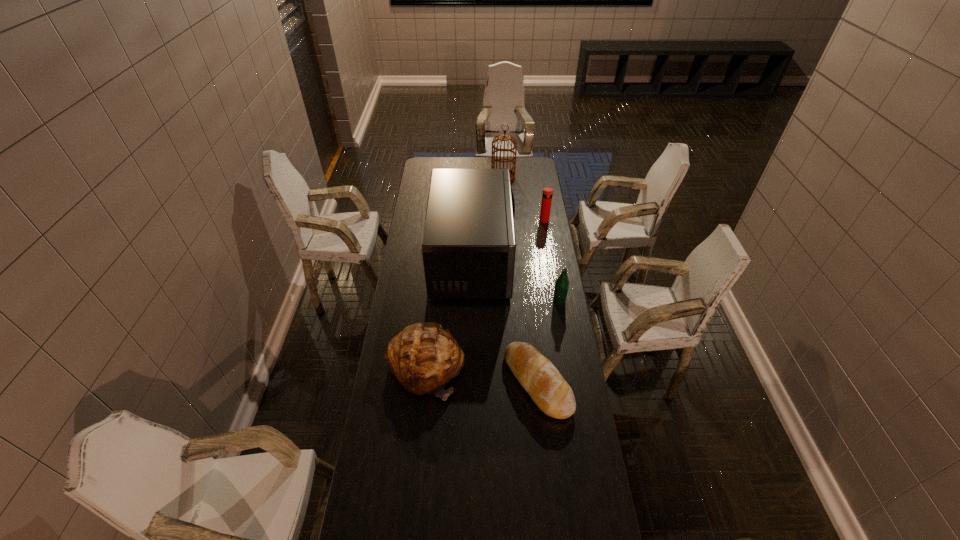
Image resolution: width=960 pixels, height=540 pixels. Find the location of `free space located 0.300m on the left of the bottle`. free space located 0.300m on the left of the bottle is located at coordinates (485, 301).

This screenshot has width=960, height=540. Find the location of `free location located on the front of the taller bread`. free location located on the front of the taller bread is located at coordinates (411, 518).

This screenshot has width=960, height=540. In order to click on vacant region located 0.190m on the back of the right bread in this screenshot , I will do `click(530, 312)`.

Identify the location of object situated at the far edge. (502, 137).

Locate an element on the screen. The image size is (960, 540). microwave oven that is at the left edge is located at coordinates (468, 247).

Where is `bread located at the left edge`? bread located at the left edge is located at coordinates (424, 357).

Identify the location of thermos bottle situated at the right edge. The image size is (960, 540). (547, 194).

At what (x,y) coordinates should I click in order to perform the action: click on bottle positioned at the right edge. Please return your answer as a coordinate pair (x, y). Looking at the image, I should click on (562, 283).

This screenshot has width=960, height=540. In order to click on bread at the right edge in this screenshot , I will do `click(537, 375)`.

Where is `vacant region at the left edge`? The image size is (960, 540). vacant region at the left edge is located at coordinates (416, 293).